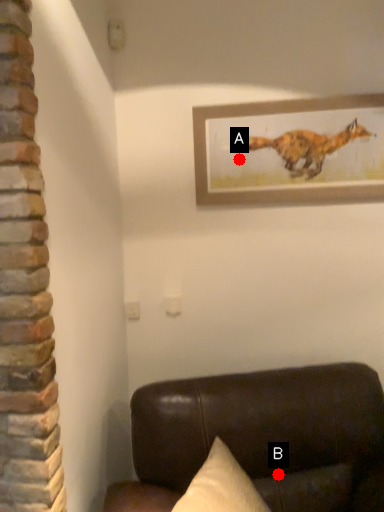
Question: Two points are circled on the image, labeled by A and B beside each circle. Among these points, which one is nearest to the camera?

Choices:
 (A) A is closer
 (B) B is closer

Answer: (B)